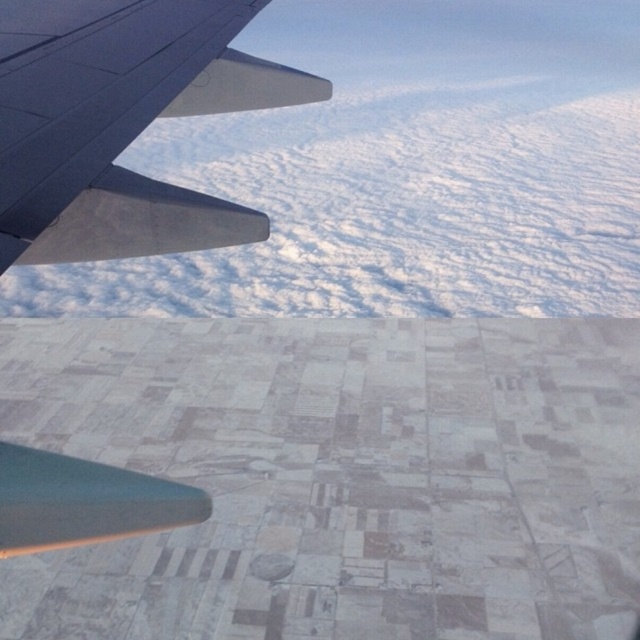
You are a passenger on the airplane and looking out the window. You see the white fluffy cloud at upper center and the metallic gray wing at upper left. Which object is closer to the top edge of the window?

The white fluffy cloud at upper center is closer to the top edge of the window because it is located above the metallic gray wing at upper left.

You are a passenger on the airplane and looking out the window. You see the white fluffy cloud at upper center and the metallic gray wing at upper left. Which object appears taller in the image?

The white fluffy cloud at upper center appears taller than the metallic gray wing at upper left in the image.

As an airplane passenger, you notice the white fluffy cloud at upper center and the metallic gray wing at upper left through the window. Which object appears larger in the window view?

The white fluffy cloud at upper center appears larger than the metallic gray wing at upper left in the window view.